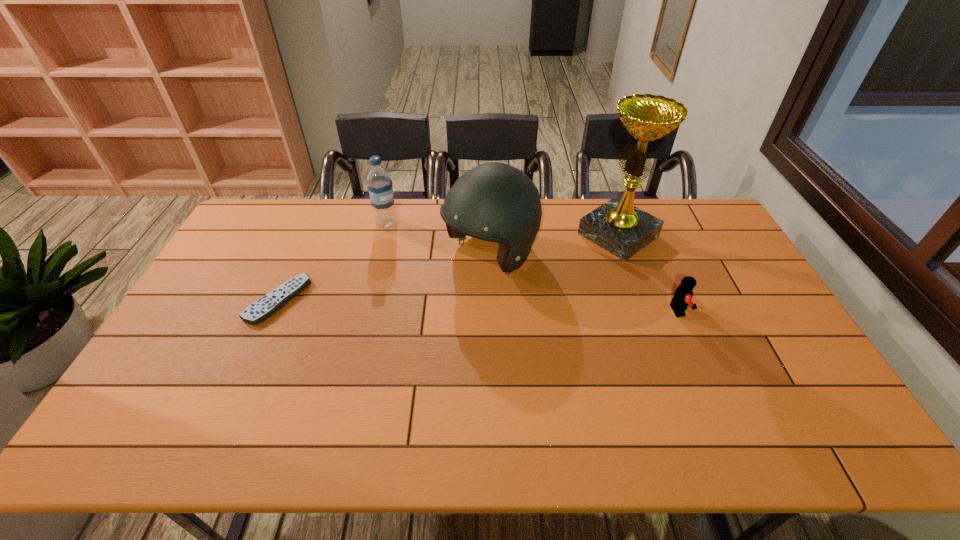
This screenshot has width=960, height=540. I want to click on vacant point located between the third object from right to left and the fourth tallest object, so click(x=585, y=282).

Find the location of a particular element. free space between the fourth tallest object and the shortest object is located at coordinates (478, 305).

At what (x,y) coordinates should I click in order to perform the action: click on vacant point located between the second tallest object and the tallest object. Please return your answer as a coordinate pair (x, y). Image resolution: width=960 pixels, height=540 pixels. Looking at the image, I should click on (554, 245).

What are the coordinates of `free spot between the fourth object from right to left and the football helmet` in the screenshot? It's located at 439,239.

I want to click on vacant space in between the Lego and the leftmost object, so click(478, 305).

Select which object appears as the second closest to the Lego. Please provide its 2D coordinates. Your answer should be formatted as a tuple, i.e. [(x, y)], where the tuple contains the x and y coordinates of a point satisfying the conditions above.

[(496, 202)]

In order to click on object that is the second nearest to the shortest object in this screenshot , I will do `click(496, 202)`.

Where is `blank area in the image that satisfies the following two spatial constraints: 1. on the back side of the tallest object; 2. on the left side of the football helmet`? blank area in the image that satisfies the following two spatial constraints: 1. on the back side of the tallest object; 2. on the left side of the football helmet is located at coordinates (490, 235).

The width and height of the screenshot is (960, 540). What are the coordinates of `free space that satisfies the following two spatial constraints: 1. on the front side of the tallest object; 2. on the front-facing side of the second shortest object` in the screenshot? It's located at (645, 310).

Where is `free location that satisfies the following two spatial constraints: 1. on the front side of the water bottle; 2. on the left side of the third object from right to left`? The height and width of the screenshot is (540, 960). free location that satisfies the following two spatial constraints: 1. on the front side of the water bottle; 2. on the left side of the third object from right to left is located at coordinates (379, 254).